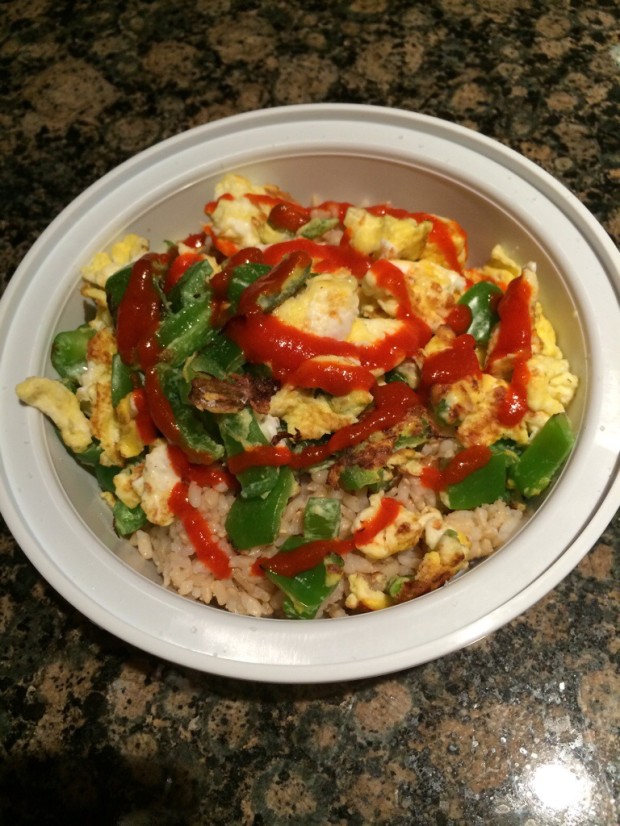
I want to click on side of bowl, so click(81, 486).